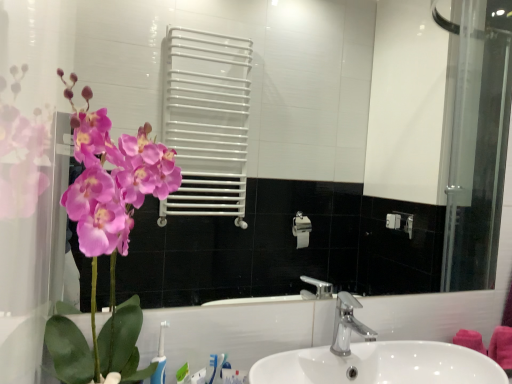
Identify the location of vacant region to the right of silver metallic faucet at center. (420, 349).